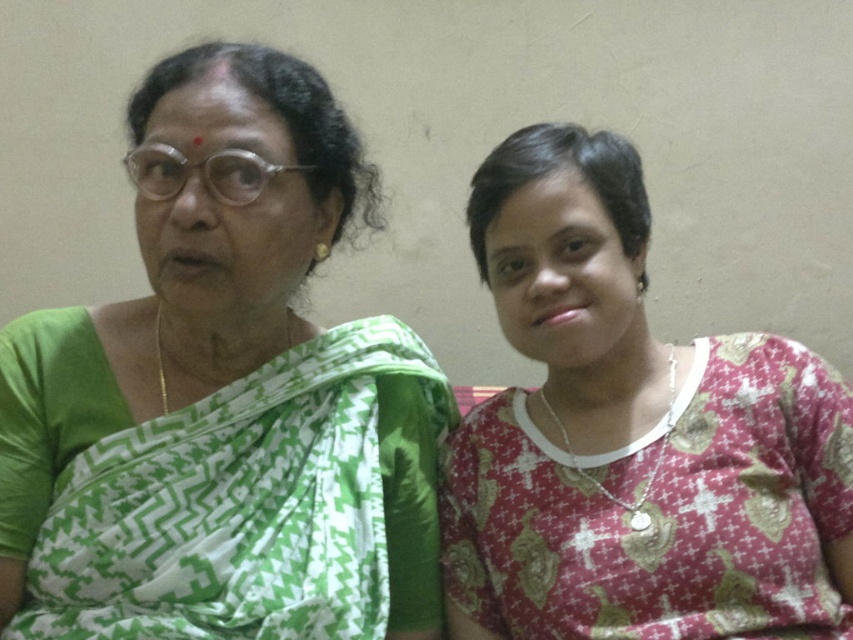
Who is positioned more to the left, green woven saree at left or pink printed blouse at right?

Positioned to the left is green woven saree at left.

Based on the photo, does green woven saree at left lie in front of pink printed blouse at right?

Yes, it is.

You are a GUI agent. You are given a task and a screenshot of the screen. Output one action in this format:
    pyautogui.click(x=<x>, y=<y>)
    Task: Click on the green woven saree at left
    The width and height of the screenshot is (853, 640).
    Given the screenshot: What is the action you would take?
    pyautogui.click(x=223, y=396)

Find the location of a particular element. green woven saree at left is located at coordinates (223, 396).